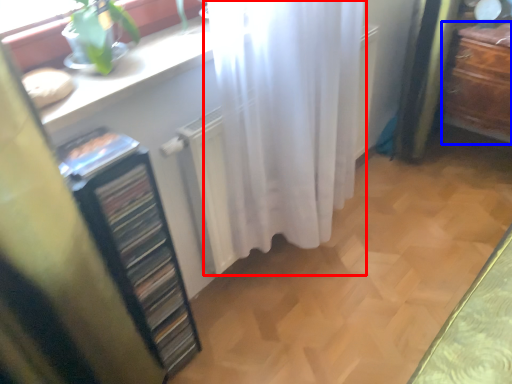
Question: Which point is further to the camera, curtain (highlighted by a red box) or furniture (highlighted by a blue box)?

Choices:
 (A) curtain
 (B) furniture

Answer: (B)